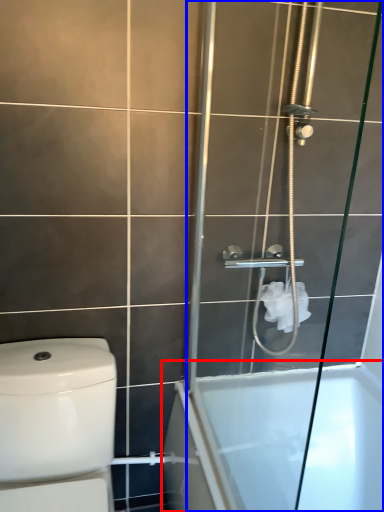
Question: Among these objects, which one is farthest to the camera, bathtub (highlighted by a red box) or screen door (highlighted by a blue box)?

Choices:
 (A) bathtub
 (B) screen door

Answer: (A)